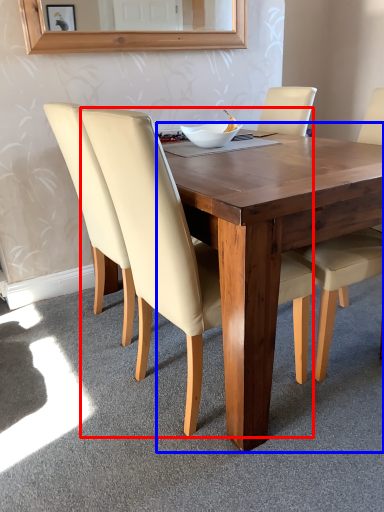
Question: Which object is further to the camera taking this photo, chair (highlighted by a red box) or round table (highlighted by a blue box)?

Choices:
 (A) chair
 (B) round table

Answer: (B)